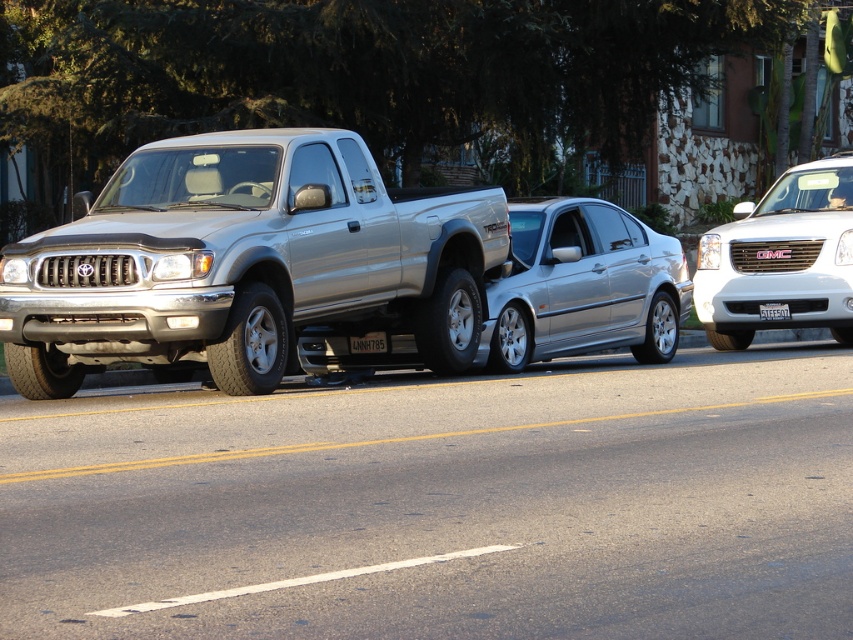
You are a traffic officer arriving at the scene of a collision. You need to identify the vehicle at the specified coordinates to file a report. Which vehicle is located at point (248, 262)?

The vehicle at point (248, 262) is the silver metallic truck at center.